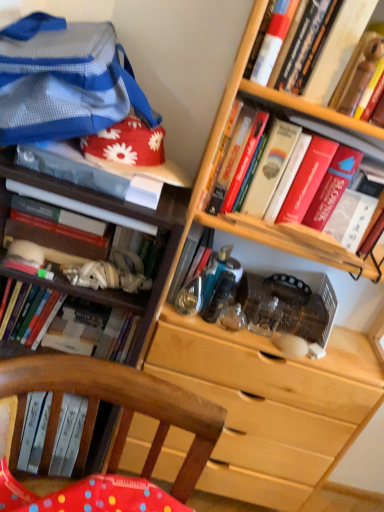
Question: From the image's perspective, is metallic blue book at center, which appears as the 5th book when viewed from the right, beneath hardcover book at center-left, the 8th book in the right-to-left sequence?

Choices:
 (A) yes
 (B) no

Answer: (A)

Question: Considering the relative positions of metallic blue book at center, which ranks as the fifth book in left-to-right order, and hardcover book at center-left, which appears as the 2th book when viewed from the left, in the image provided, is metallic blue book at center, which ranks as the fifth book in left-to-right order, to the right of hardcover book at center-left, which appears as the 2th book when viewed from the left, from the viewer's perspective?

Choices:
 (A) no
 (B) yes

Answer: (B)

Question: Can you confirm if metallic blue book at center, which ranks as the fifth book in left-to-right order, is bigger than hardcover book at center-left, the 8th book in the right-to-left sequence?

Choices:
 (A) yes
 (B) no

Answer: (B)

Question: From a real-world perspective, is metallic blue book at center, which appears as the 5th book when viewed from the right, on hardcover book at center-left, which appears as the 2th book when viewed from the left?

Choices:
 (A) no
 (B) yes

Answer: (A)

Question: Does metallic blue book at center, which appears as the 5th book when viewed from the right, have a greater height compared to hardcover book at center-left, the 8th book in the right-to-left sequence?

Choices:
 (A) yes
 (B) no

Answer: (A)

Question: Looking at the image, does matte white book at upper left, the fourth book viewed from the left, seem bigger or smaller compared to metallic blue book at center, which appears as the 5th book when viewed from the right?

Choices:
 (A) big
 (B) small

Answer: (A)

Question: Does point (64, 174) appear closer or farther from the camera than point (208, 254)?

Choices:
 (A) closer
 (B) farther

Answer: (A)

Question: Is matte white book at upper left, acting as the 6th book starting from the right, wider or thinner than metallic blue book at center, which ranks as the fifth book in left-to-right order?

Choices:
 (A) wide
 (B) thin

Answer: (A)

Question: In terms of height, does matte white book at upper left, the fourth book viewed from the left, look taller or shorter compared to metallic blue book at center, which appears as the 5th book when viewed from the right?

Choices:
 (A) tall
 (B) short

Answer: (B)

Question: Relative to hardcover book at left, arranged as the 9th book when viewed from the right, is white matte book at upper right, the 6th book when ordered from left to right, in front or behind?

Choices:
 (A) behind
 (B) front

Answer: (B)

Question: Considering the positions of white matte book at upper right, the 6th book when ordered from left to right, and hardcover book at left, arranged as the 9th book when viewed from the right, in the image, is white matte book at upper right, the 6th book when ordered from left to right, wider or thinner than hardcover book at left, arranged as the 9th book when viewed from the right,?

Choices:
 (A) wide
 (B) thin

Answer: (B)

Question: From a real-world perspective, is white matte book at upper right, positioned as the 4th book in right-to-left order, above or below hardcover book at left, arranged as the 9th book when viewed from the right?

Choices:
 (A) above
 (B) below

Answer: (A)

Question: Is point (283, 20) positioned closer to the camera than point (39, 322)?

Choices:
 (A) closer
 (B) farther

Answer: (A)

Question: In terms of width, does hardcover book at upper right, which is counted as the 1th book, starting from the right, look wider or thinner when compared to hardcover book at left, the first book from the left?

Choices:
 (A) wide
 (B) thin

Answer: (B)

Question: In terms of height, does hardcover book at upper right, which is the ninth book in left-to-right order, look taller or shorter compared to hardcover book at left, arranged as the 9th book when viewed from the right?

Choices:
 (A) tall
 (B) short

Answer: (B)